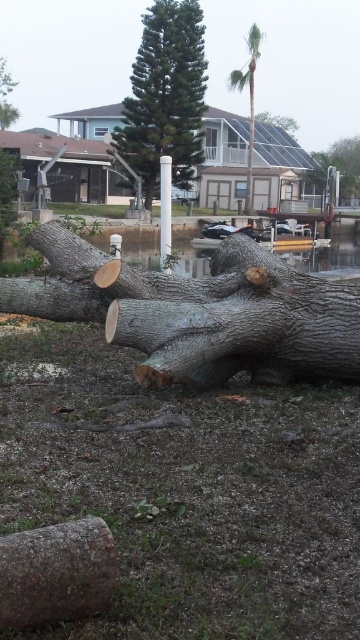
You are a park maintenance worker who needs to assess the height of the gray rough tree trunk at center and the brown rough log at lower left. Which object is taller?

The gray rough tree trunk at center is taller than the brown rough log at lower left according to the description.

You are standing on the grassy area near the water and want to place a small potted plant between the brown rough log at lower left and the smooth gray log at center. Based on their positions, where should you place the potted plant?

The brown rough log at lower left is located below the smooth gray log at center, so you should place the potted plant between them by positioning it above the brown rough log at lower left and below the smooth gray log at center.